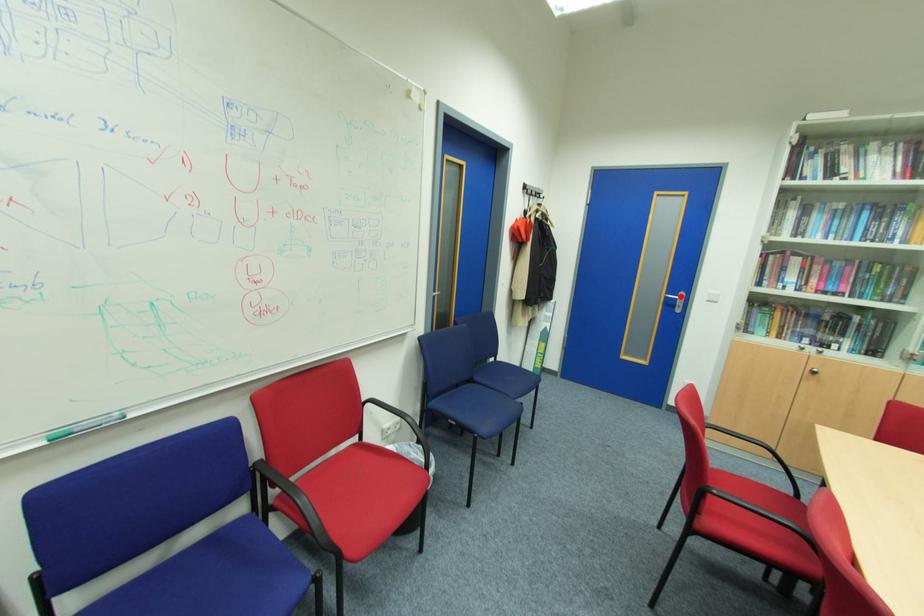
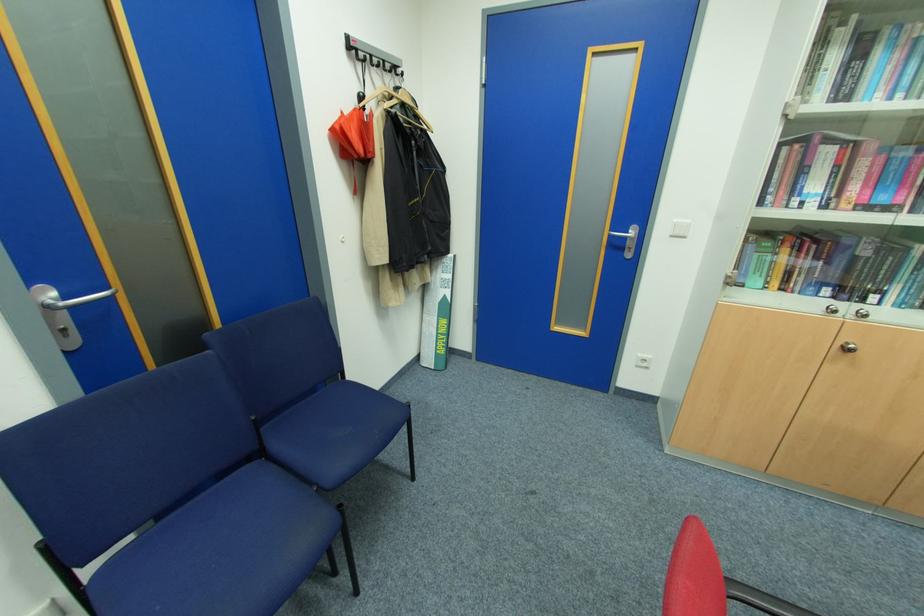
Where in the second image is the point corresponding to the highlighted location from the first image?

(630, 233)